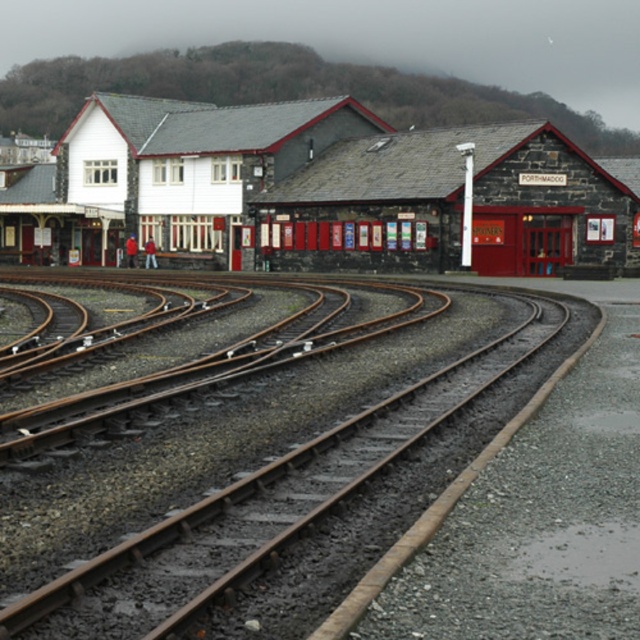
Question: Can you confirm if stone brick railway station at center is bigger than brown metallic tracks at center?

Choices:
 (A) yes
 (B) no

Answer: (A)

Question: Does stone brick railway station at center have a larger size compared to brown metallic tracks at center?

Choices:
 (A) yes
 (B) no

Answer: (A)

Question: Which point is farther from the camera taking this photo?

Choices:
 (A) (416, 148)
 (B) (125, 556)

Answer: (A)

Question: Which of the following is the farthest from the observer?

Choices:
 (A) [616, 227]
 (B) [276, 515]

Answer: (A)

Question: Where is stone brick railway station at center located in relation to brown metallic tracks at center in the image?

Choices:
 (A) left
 (B) right

Answer: (A)